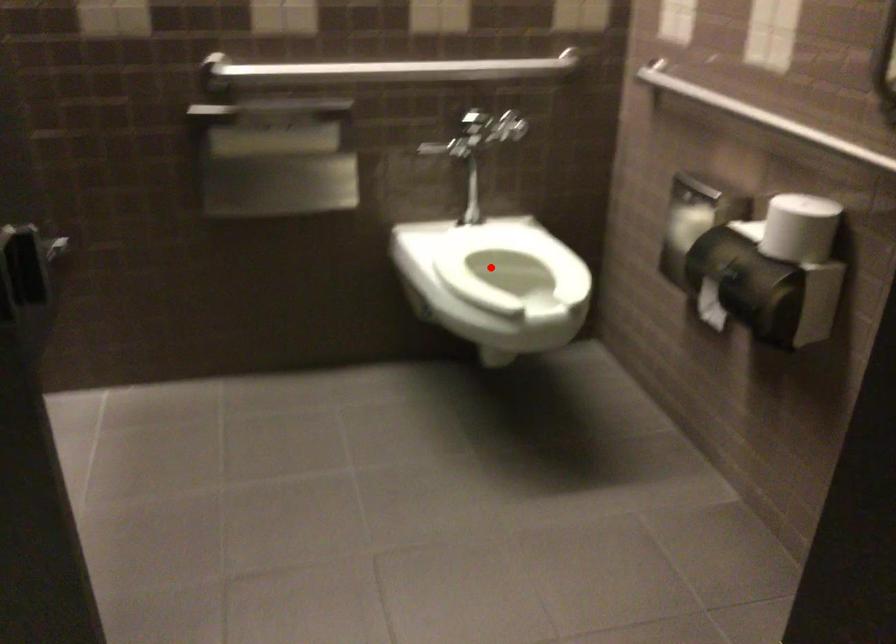
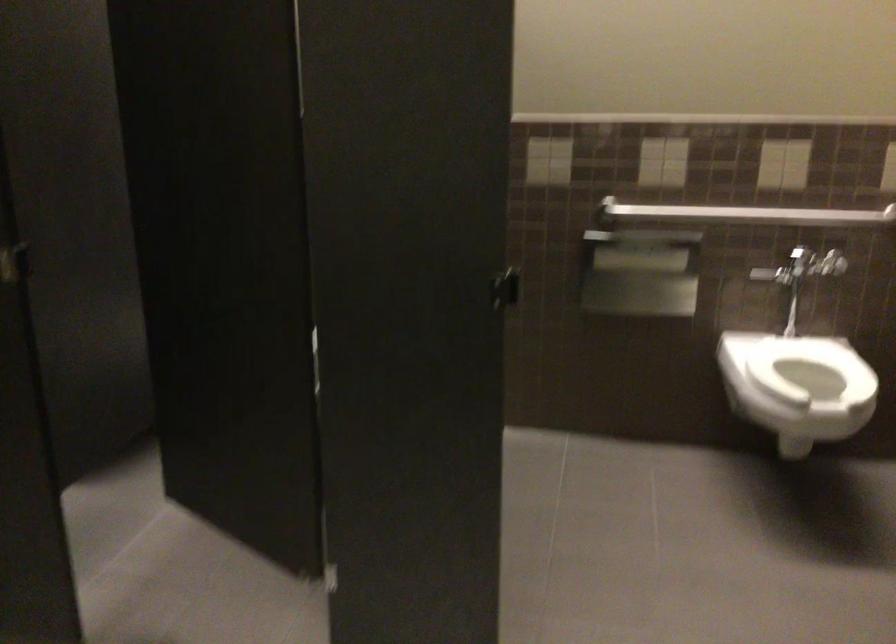
Question: I am providing you with two images of the same scene from different viewpoints. In image1, a red point is highlighted. Considering the same 3D point in image2, which of the following is correct?

Choices:
 (A) It is closer
 (B) It is farther

Answer: (B)